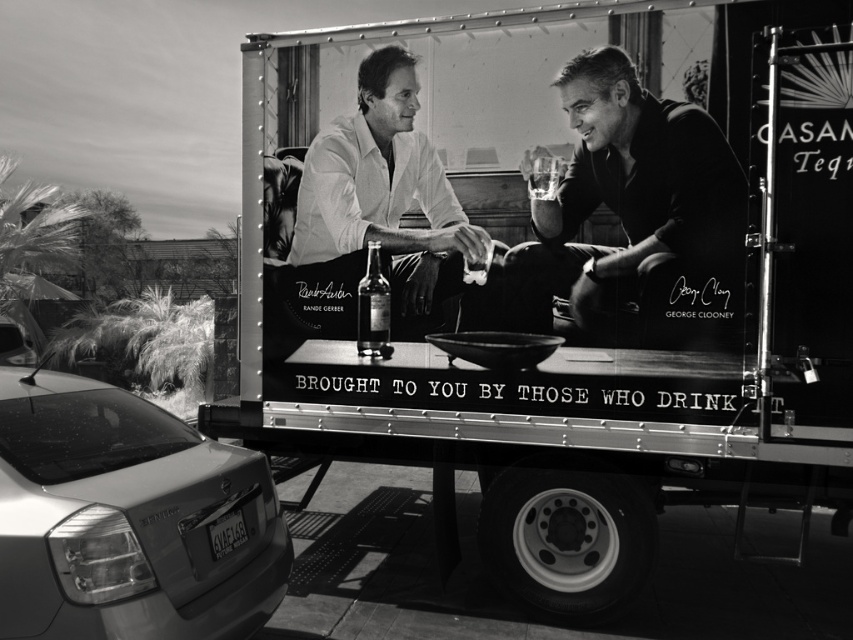
Looking at this image, measure the distance between satin silver sedan at lower left and camera.

The distance of satin silver sedan at lower left from camera is 8.56 feet.

Measure the distance between satin silver sedan at lower left and camera.

satin silver sedan at lower left and camera are 2.61 meters apart.

This screenshot has width=853, height=640. I want to click on satin silver sedan at lower left, so click(x=128, y=518).

Measure the distance between point (376, 262) and camera.

Point (376, 262) and camera are 14.08 feet apart from each other.

Between clear glass bottle at center and translucent glass at center, which one is positioned lower?

clear glass bottle at center is lower down.

Is point (390, 355) farther from viewer compared to point (538, 186)?

Yes, point (390, 355) is behind point (538, 186).

Find the location of a particular element. clear glass bottle at center is located at coordinates (373, 307).

Does matte white shirt at center have a lesser width compared to clear glass bottle at center?

No, matte white shirt at center is not thinner than clear glass bottle at center.

Image resolution: width=853 pixels, height=640 pixels. Describe the element at coordinates (386, 200) in the screenshot. I see `matte white shirt at center` at that location.

Which is in front, point (462, 289) or point (370, 257)?

Point (462, 289) is more forward.

What are the coordinates of `matte white shirt at center` in the screenshot? It's located at (386, 200).